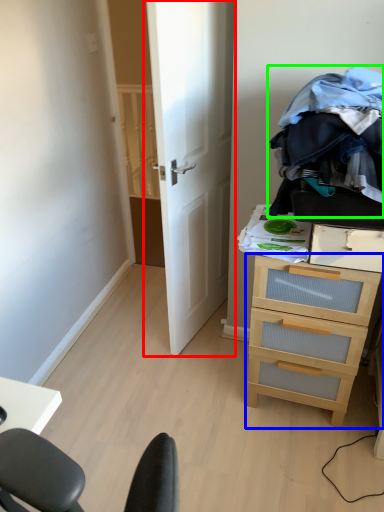
Question: Estimate the real-world distances between objects in this image. Which object is closer to door (highlighted by a red box), chest of drawers (highlighted by a blue box) or clothing (highlighted by a green box)?

Choices:
 (A) chest of drawers
 (B) clothing

Answer: (B)